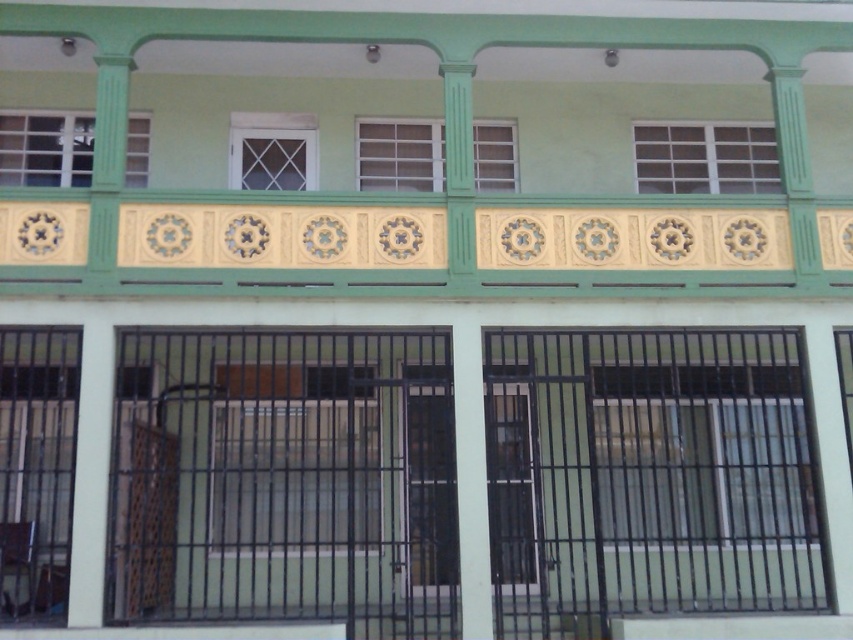
Based on the photo, you are an architect designing a new building inspired by this facade. You need to ensure that the yellow matte tile at upper center and the white lattice window at center are proportionally balanced. Based on their sizes, which element should be placed in a more prominent position to maintain visual harmony?

Since the yellow matte tile at upper center is smaller than the white lattice window at center, the white lattice window at center should be placed in a more prominent position to maintain visual harmony.

You are an architect evaluating the building facade. You need to determine which window has a greater width between the clear glass window at center and the matte green window at upper left. Based on the description, which one is wider?

The clear glass window at center is wider than the matte green window at upper left because its width surpasses the latter according to the description.